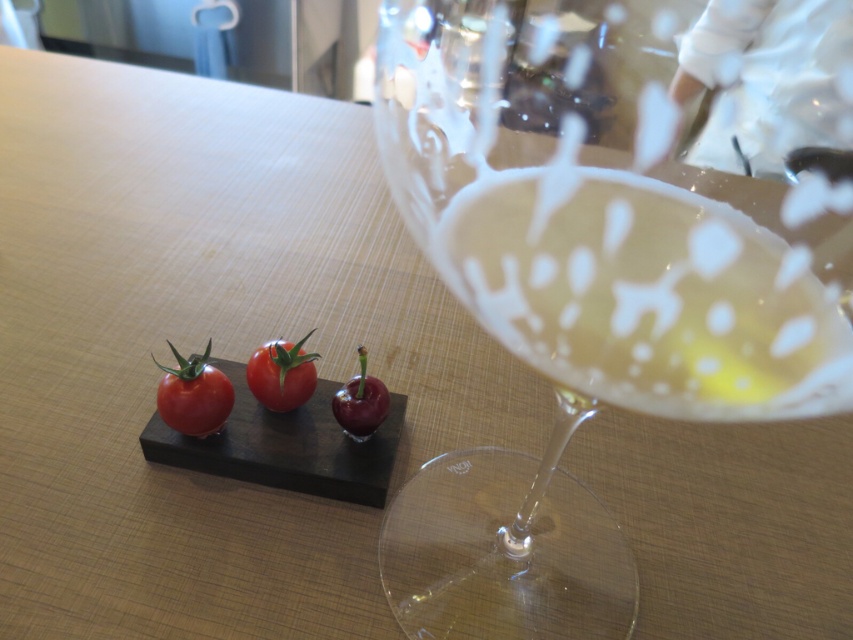
Question: Which point appears closest to the camera in this image?

Choices:
 (A) (778, 240)
 (B) (186, 362)

Answer: (A)

Question: Is clear glass wine glass at center bigger than translucent glass wine at right?

Choices:
 (A) yes
 (B) no

Answer: (A)

Question: Estimate the real-world distances between objects in this image. Which object is closer to the glossy red tomato at center?

Choices:
 (A) shiny red cherry at center
 (B) matte red tomato at center
 (C) translucent glass wine at right
 (D) clear glass wine glass at center

Answer: (B)

Question: Which object appears farthest from the camera in this image?

Choices:
 (A) clear glass wine glass at center
 (B) translucent glass wine at right
 (C) shiny red cherry at center

Answer: (C)

Question: Does translucent glass wine at right have a larger size compared to glossy red tomato at center?

Choices:
 (A) yes
 (B) no

Answer: (A)

Question: Is matte red tomato at center below glossy red tomato at center?

Choices:
 (A) no
 (B) yes

Answer: (B)